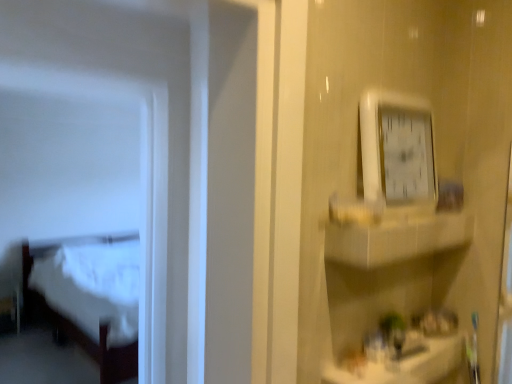
What do you see at coordinates (44, 256) in the screenshot? I see `white wood bed at left` at bounding box center [44, 256].

Where is `white wood bed at left`? The height and width of the screenshot is (384, 512). white wood bed at left is located at coordinates (44, 256).

In order to face white glossy counter top at lower right, should I rotate leftwards or rightwards?

You should look right and rotate roughly 19.305 degrees.

Identify the location of white glossy cabinet at upper right. This screenshot has height=384, width=512. (396, 238).

Image resolution: width=512 pixels, height=384 pixels. I want to click on white wood bed at left, so click(x=44, y=256).

Identify the location of clock that is above the white glossy cabinet at upper right (from a real-world perspective). The image size is (512, 384). (397, 151).

From the image's perspective, would you say white plastic clock at upper right is shown under white glossy cabinet at upper right?

No, from the image's perspective, white plastic clock at upper right is not beneath white glossy cabinet at upper right.

Consider the image. Is white plastic clock at upper right to the right of white glossy cabinet at upper right from the viewer's perspective?

Incorrect, white plastic clock at upper right is not on the right side of white glossy cabinet at upper right.

Is point (401, 150) closer or farther from the camera than point (116, 236)?

Point (401, 150) is positioned closer to the camera compared to point (116, 236).

Which object is further away from the camera taking this photo, white plastic clock at upper right or white wood bed at left?

white wood bed at left is more distant.

Between white glossy counter top at lower right and white plastic clock at upper right, which one has smaller width?

Thinner between the two is white plastic clock at upper right.

From the image's perspective, relative to white plastic clock at upper right, is white glossy counter top at lower right above or below?

white glossy counter top at lower right is below white plastic clock at upper right.

Who is more distant, white glossy counter top at lower right or white plastic clock at upper right?

white plastic clock at upper right is more distant.

Is the surface of white glossy counter top at lower right in direct contact with white wood bed at left?

No, white glossy counter top at lower right is not with white wood bed at left.

Is white glossy counter top at lower right facing towards white wood bed at left?

No, white glossy counter top at lower right does not turn towards white wood bed at left.

Is white glossy counter top at lower right positioned in front of white wood bed at left?

Yes.

Considering the relative sizes of white glossy counter top at lower right and white wood bed at left in the image provided, is white glossy counter top at lower right wider than white wood bed at left?

No.

From the picture: From a real-world perspective, between white glossy cabinet at upper right and white wood bed at left, who is vertically lower?

white wood bed at left.

Is white glossy cabinet at upper right wider than white wood bed at left?

No, white glossy cabinet at upper right is not wider than white wood bed at left.

Is white glossy cabinet at upper right inside the boundaries of white wood bed at left, or outside?

white glossy cabinet at upper right cannot be found inside white wood bed at left.

Locate an element on the screen. This screenshot has height=384, width=512. cabinet in front of the white wood bed at left is located at coordinates (396, 238).

Is white plastic clock at upper right located within white glossy cabinet at upper right?

No, white plastic clock at upper right is not a part of white glossy cabinet at upper right.

Is white glossy cabinet at upper right next to white plastic clock at upper right and touching it?

No.

Is white glossy cabinet at upper right closer to camera compared to white plastic clock at upper right?

Yes, white glossy cabinet at upper right is closer to the viewer.

Between white glossy cabinet at upper right and white plastic clock at upper right, which one appears on the right side from the viewer's perspective?

white glossy cabinet at upper right.

Is white glossy counter top at lower right directly adjacent to white glossy cabinet at upper right?

No, white glossy counter top at lower right is not beside white glossy cabinet at upper right.

Is white glossy counter top at lower right positioned with its back to white glossy cabinet at upper right?

white glossy counter top at lower right is not turned away from white glossy cabinet at upper right.

Does point (445, 344) come farther from viewer compared to point (375, 232)?

Yes, it is.

Considering the positions of objects white glossy counter top at lower right and white glossy cabinet at upper right in the image provided, who is more to the left, white glossy counter top at lower right or white glossy cabinet at upper right?

white glossy counter top at lower right is more to the left.

The height and width of the screenshot is (384, 512). I want to click on clock above the white glossy cabinet at upper right (from a real-world perspective), so point(397,151).

Locate an element on the screen. The height and width of the screenshot is (384, 512). furniture below the white plastic clock at upper right (from the image's perspective) is located at coordinates (44, 256).

Estimate the real-world distances between objects in this image. Which object is closer to white glossy counter top at lower right, white plastic clock at upper right or white glossy cabinet at upper right?

white glossy cabinet at upper right is closer to white glossy counter top at lower right.

Based on their spatial positions, is white plastic clock at upper right or white glossy counter top at lower right closer to white wood bed at left?

Among the two, white glossy counter top at lower right is located nearer to white wood bed at left.

Estimate the real-world distances between objects in this image. Which object is closer to white wood bed at left, white glossy counter top at lower right or white glossy cabinet at upper right?

Based on the image, white glossy counter top at lower right appears to be nearer to white wood bed at left.

From the image, which object appears to be nearer to white glossy counter top at lower right, white wood bed at left or white glossy cabinet at upper right?

white glossy cabinet at upper right.

From the image, which object appears to be farther from white glossy cabinet at upper right, white wood bed at left or white plastic clock at upper right?

The object further to white glossy cabinet at upper right is white wood bed at left.

Looking at the image, which one is located closer to white plastic clock at upper right, white wood bed at left or white glossy cabinet at upper right?

white glossy cabinet at upper right.

Which object lies further to the anchor point white wood bed at left, white glossy counter top at lower right or white plastic clock at upper right?

Among the two, white plastic clock at upper right is located further to white wood bed at left.

Considering their positions, is white glossy counter top at lower right positioned further to white plastic clock at upper right than white wood bed at left?

white wood bed at left.

The height and width of the screenshot is (384, 512). In order to click on cabinet between white plastic clock at upper right and white glossy counter top at lower right in the up-down direction in this screenshot , I will do `click(396, 238)`.

I want to click on counter top between white glossy cabinet at upper right and white wood bed at left along the z-axis, so click(x=407, y=366).

In order to click on clock between white glossy cabinet at upper right and white wood bed at left from front to back in this screenshot , I will do `click(397, 151)`.

Identify the location of clock located between white glossy counter top at lower right and white wood bed at left in the depth direction. The height and width of the screenshot is (384, 512). (397, 151).